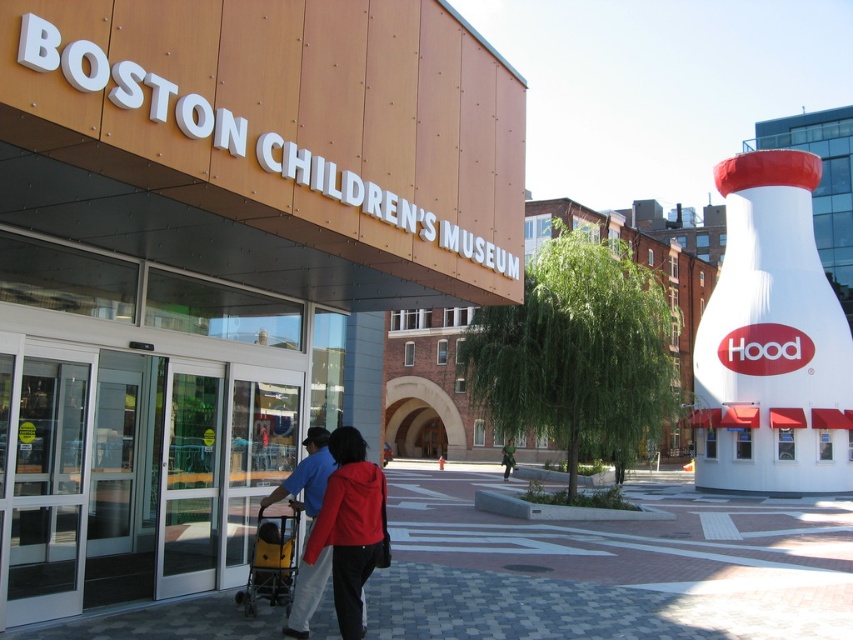
You are a photographer taking a picture of the Boston Children Museum. You have a matte blue shirt at center and a yellow plastic baby carriage at lower left in your frame. Which object appears narrower in the photo?

The matte blue shirt at center appears narrower than the yellow plastic baby carriage at lower left because it is thinner.

You are a parent holding a yellow plastic baby carriage at lower left and want to place a matte red jacket at center onto it. Is the jacket too big to fit on the carriage?

The matte red jacket at center is much taller than the yellow plastic baby carriage at lower left, so the jacket is too big to fit on the carriage.